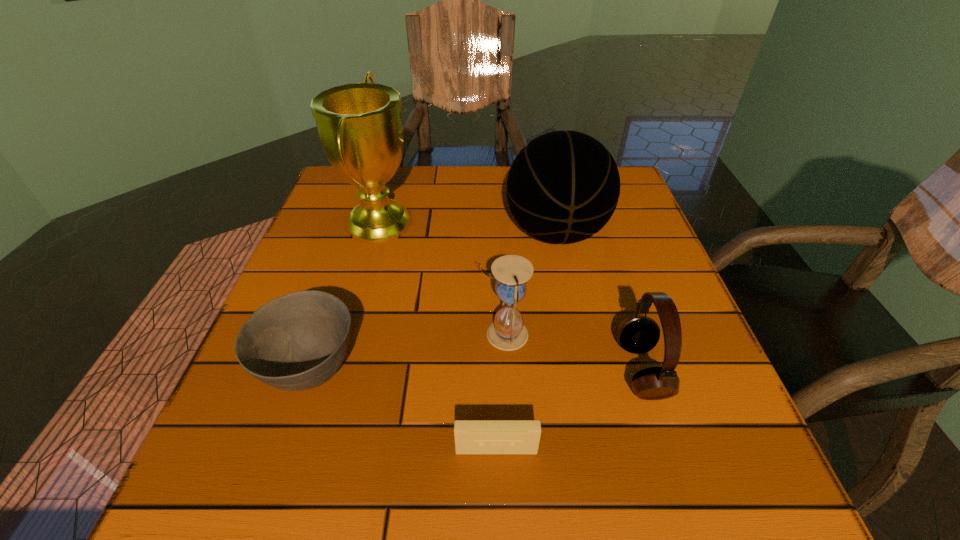
Image resolution: width=960 pixels, height=540 pixels. I want to click on headset that is at the right edge, so click(x=637, y=334).

Locate an element on the screen. Image resolution: width=960 pixels, height=540 pixels. object that is at the far left corner is located at coordinates (360, 127).

I want to click on object at the far right corner, so click(x=563, y=187).

Find the location of a particular element. Image resolution: width=960 pixels, height=540 pixels. vacant area at the far edge of the desktop is located at coordinates [440, 188].

Where is `free region at the left edge of the desktop`? The height and width of the screenshot is (540, 960). free region at the left edge of the desktop is located at coordinates (331, 215).

This screenshot has height=540, width=960. What are the coordinates of `blank area at the right edge` in the screenshot? It's located at (621, 256).

Where is `vacant space at the far left corner of the desktop`? The height and width of the screenshot is (540, 960). vacant space at the far left corner of the desktop is located at coordinates (348, 190).

In the image, there is a desktop. At what (x,y) coordinates should I click in order to perform the action: click on vacant space at the near left corner. Please return your answer as a coordinate pair (x, y). Image resolution: width=960 pixels, height=540 pixels. Looking at the image, I should click on (193, 472).

In the image, there is a desktop. Find the location of `vacant space at the far right corner`. vacant space at the far right corner is located at coordinates (641, 213).

You are a GUI agent. You are given a task and a screenshot of the screen. Output one action in this format:
    pyautogui.click(x=<x>, y=<y>)
    Task: Click on the blank space at the near right corner of the desktop
    The image size is (960, 540).
    Given the screenshot: What is the action you would take?
    pyautogui.click(x=657, y=470)